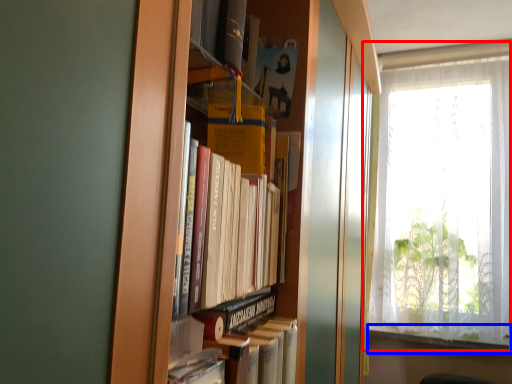
Question: Which object is closer to the camera taking this photo, window (highlighted by a red box) or window sill (highlighted by a blue box)?

Choices:
 (A) window
 (B) window sill

Answer: (A)